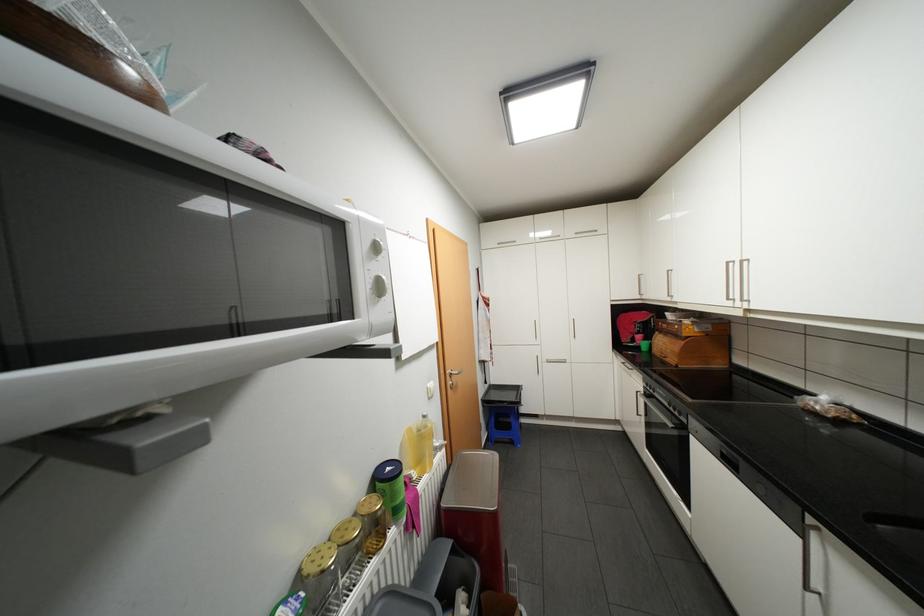
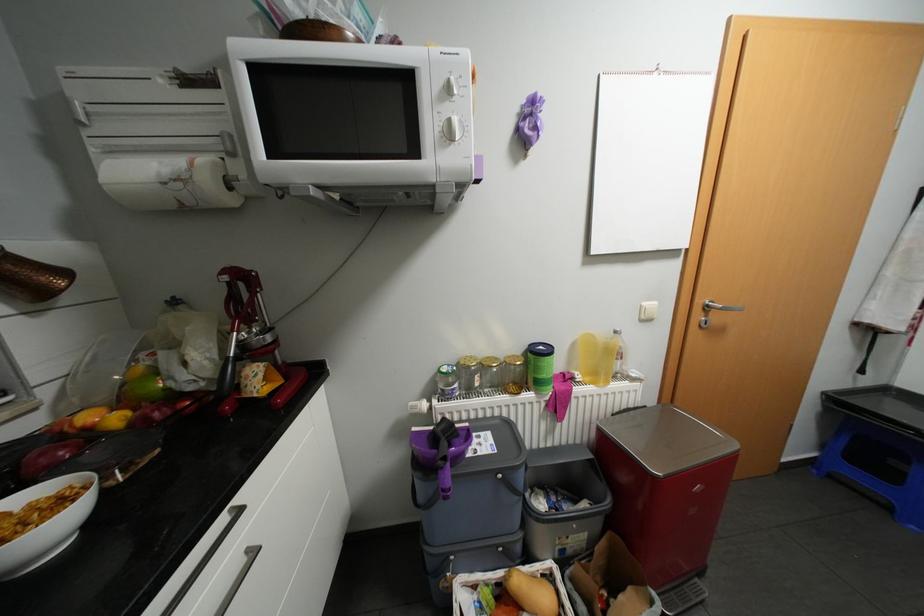
Find the pixel in the second image that matches [422,474] in the first image.

(587, 377)